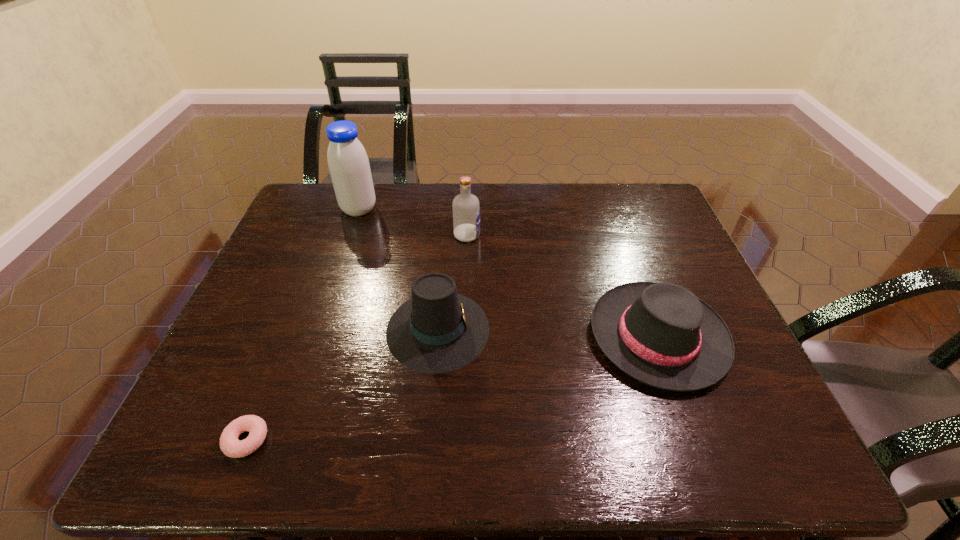
Find the location of a particular element. The width and height of the screenshot is (960, 540). free space located on the right of the farthest object is located at coordinates (420, 210).

Find the location of `free space located 0.100m on the label of the fourth shortest object`. free space located 0.100m on the label of the fourth shortest object is located at coordinates (514, 235).

Identify the location of free space located on the front-facing side of the left dress hat. The image size is (960, 540). (606, 329).

What are the coordinates of `free space located 0.170m on the left of the second shortest object` in the screenshot? It's located at (519, 336).

Find the location of a particular element. vacant region located 0.050m on the right of the nearest object is located at coordinates (294, 440).

This screenshot has width=960, height=540. I want to click on object that is at the far edge, so click(x=348, y=163).

At what (x,y) coordinates should I click in order to perform the action: click on object at the near edge. Please return your answer as a coordinate pair (x, y). Looking at the image, I should click on (230, 445).

Where is `soya milk located at the left edge`? The image size is (960, 540). soya milk located at the left edge is located at coordinates (348, 163).

The height and width of the screenshot is (540, 960). I want to click on doughnut present at the left edge, so click(230, 445).

Identify the location of object at the right edge. This screenshot has height=540, width=960. (661, 334).